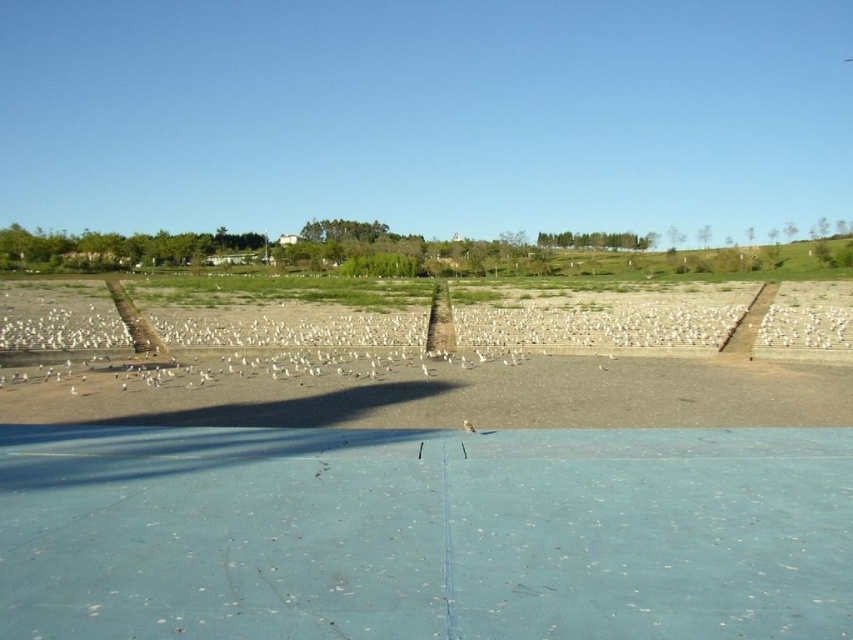
Is point (709, 346) farther from camera compared to point (471, 432)?

Yes, it is behind point (471, 432).

Is brown sandy dirt at center wider than brown feathered bird at center?

Yes.

Is point (508, 372) positioned behind point (469, 424)?

Yes.

The height and width of the screenshot is (640, 853). I want to click on brown sandy dirt at center, so click(436, 360).